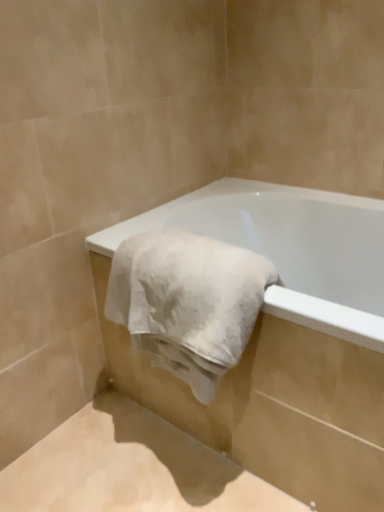
Question: Visually, is white matte bathtub at center positioned to the left or to the right of white soft towel at center?

Choices:
 (A) right
 (B) left

Answer: (A)

Question: Is white matte bathtub at center bigger or smaller than white soft towel at center?

Choices:
 (A) small
 (B) big

Answer: (B)

Question: Do you think white matte bathtub at center is within white soft towel at center, or outside of it?

Choices:
 (A) outside
 (B) inside

Answer: (A)

Question: Based on their positions, is white soft towel at center located to the left or right of white matte bathtub at center?

Choices:
 (A) right
 (B) left

Answer: (B)

Question: Is white soft towel at center inside or outside of white matte bathtub at center?

Choices:
 (A) inside
 (B) outside

Answer: (A)

Question: Considering the positions of white soft towel at center and white matte bathtub at center in the image, is white soft towel at center bigger or smaller than white matte bathtub at center?

Choices:
 (A) small
 (B) big

Answer: (A)

Question: From the image's perspective, is white soft towel at center located above or below white matte bathtub at center?

Choices:
 (A) above
 (B) below

Answer: (A)